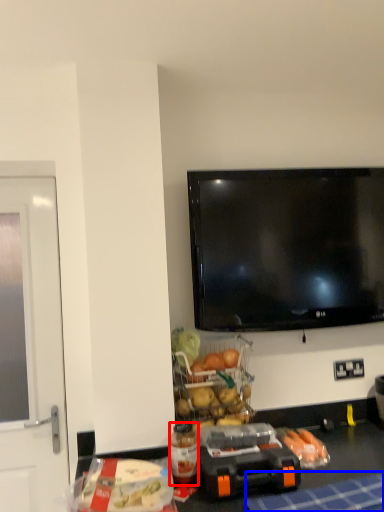
Question: Which object is further to the camera taking this photo, bottle (highlighted by a red box) or tablecloth (highlighted by a blue box)?

Choices:
 (A) bottle
 (B) tablecloth

Answer: (A)